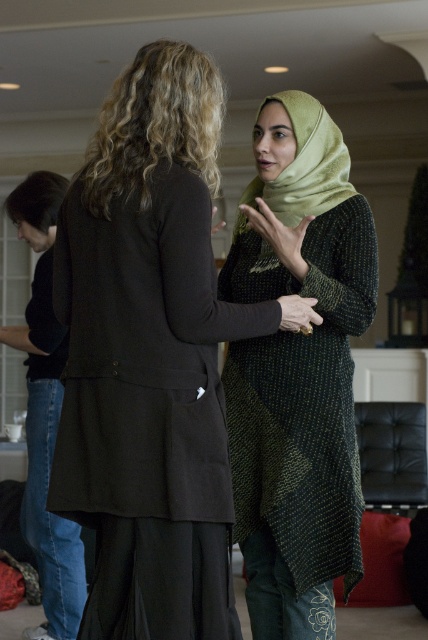
You are standing in the room and want to place a small plant exactly at the center of the room. The center is marked at point coordinates of 0.5, 0.5. Is the matte black coat at center located closer to the center than 0.1 units?

The matte black coat at center is located at point coordinates of (151, 356). The distance from the center point (214, 320) is calculated using the Euclidean distance formula. The difference in the x coordinate is 0.058 and the difference in the y coordinate is 0.145. The square of these differences are 0.003364 and 0.021025 respectively. Adding them gives 0.024389, and taking the square root gives approximately 0.156. Since 0.156 is greater than 0.1 units, the matte black coat at center is not closer to 0.

You are taking a photo of the two people in the scene. The first person is at point (374, 259) and the second person is at point (253, 189). Which person will appear larger in your photo?

Point (374, 259) is closer to the camera than point (253, 189), so the first person will appear larger in the photo.